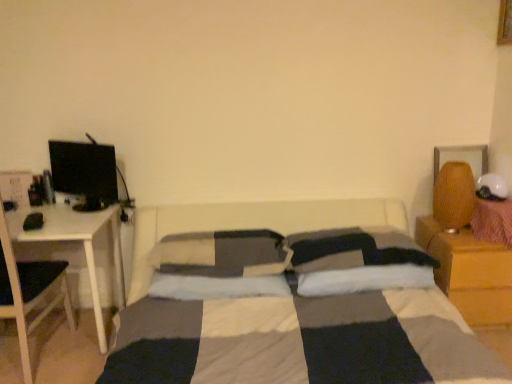
What do you see at coordinates (216, 287) in the screenshot?
I see `soft gray pillow at center, which ranks as the second pillow in left-to-right order` at bounding box center [216, 287].

Locate an element on the screen. white soft pillow at center, the 3th pillow in the left-to-right sequence is located at coordinates (357, 261).

Measure the distance between point (304, 264) and camera.

Point (304, 264) is 2.13 meters from camera.

From the picture: Measure the distance between white soft pillow at center, the 3th pillow when ordered from right to left, and camera.

white soft pillow at center, the 3th pillow when ordered from right to left, and camera are 2.14 meters apart from each other.

The height and width of the screenshot is (384, 512). What do you see at coordinates (222, 254) in the screenshot? I see `white soft pillow at center, which is the 1th pillow in left-to-right order` at bounding box center [222, 254].

Locate an element on the screen. Image resolution: width=512 pixels, height=384 pixels. textured brown lampshade at right is located at coordinates (454, 196).

You are a GUI agent. You are given a task and a screenshot of the screen. Output one action in this format:
    pyautogui.click(x=<x>, y=<y>)
    Task: Click on the 3rd pillow below when counting from the textured brown lampshade at right (from the image's perspective)
    The image size is (512, 384).
    Given the screenshot: What is the action you would take?
    pyautogui.click(x=216, y=287)

Is there a large distance between soft gray pillow at center, marked as the second pillow in a right-to-left arrangement, and textured brown lampshade at right?

Absolutely, soft gray pillow at center, marked as the second pillow in a right-to-left arrangement, is distant from textured brown lampshade at right.

Between soft gray pillow at center, which ranks as the second pillow in left-to-right order, and textured brown lampshade at right, which one is positioned behind?

textured brown lampshade at right.

Does white soft pillow at center, the 3th pillow when ordered from right to left, have a lesser width compared to soft gray pillow at center, which ranks as the second pillow in left-to-right order?

No, white soft pillow at center, the 3th pillow when ordered from right to left, is not thinner than soft gray pillow at center, which ranks as the second pillow in left-to-right order.

Would you say white soft pillow at center, which is the 1th pillow in left-to-right order, contains soft gray pillow at center, which ranks as the second pillow in left-to-right order?

That's incorrect, soft gray pillow at center, which ranks as the second pillow in left-to-right order, is not inside white soft pillow at center, which is the 1th pillow in left-to-right order.

Is point (251, 253) positioned in front of point (234, 278)?

No, (251, 253) is further to viewer.

From the image's perspective, does soft gray pillow at center, which ranks as the second pillow in left-to-right order, appear lower than black glossy computer monitor at left?

Indeed, from the image's perspective, soft gray pillow at center, which ranks as the second pillow in left-to-right order, is shown beneath black glossy computer monitor at left.

Is soft gray pillow at center, which ranks as the second pillow in left-to-right order, turned away from black glossy computer monitor at left?

No.

What's the angular difference between soft gray pillow at center, marked as the second pillow in a right-to-left arrangement, and black glossy computer monitor at left's facing directions?

There is a 28.7-degree angle between the facing directions of soft gray pillow at center, marked as the second pillow in a right-to-left arrangement, and black glossy computer monitor at left.

Who is more distant, soft gray pillow at center, which ranks as the second pillow in left-to-right order, or black glossy computer monitor at left?

black glossy computer monitor at left.

From the image's perspective, is soft gray pillow at center, which ranks as the second pillow in left-to-right order, over white soft pillow at center, the first pillow when ordered from right to left?

No, from the image's perspective, soft gray pillow at center, which ranks as the second pillow in left-to-right order, is not over white soft pillow at center, the first pillow when ordered from right to left.

Locate an element on the screen. The height and width of the screenshot is (384, 512). pillow below the white soft pillow at center, the first pillow when ordered from right to left (from the image's perspective) is located at coordinates (216, 287).

Does soft gray pillow at center, marked as the second pillow in a right-to-left arrangement, have a lesser height compared to white soft pillow at center, the first pillow when ordered from right to left?

No.

Does soft gray pillow at center, which ranks as the second pillow in left-to-right order, have a smaller size compared to white soft pillow at center, the 3th pillow in the left-to-right sequence?

Incorrect, soft gray pillow at center, which ranks as the second pillow in left-to-right order, is not smaller in size than white soft pillow at center, the 3th pillow in the left-to-right sequence.

Is there a large distance between white soft pillow at center, the first pillow when ordered from right to left, and wooden nightstand at right?

No, white soft pillow at center, the first pillow when ordered from right to left, is in close proximity to wooden nightstand at right.

How much distance is there between white soft pillow at center, the first pillow when ordered from right to left, and wooden nightstand at right?

They are 15.18 inches apart.

Is white soft pillow at center, the 3th pillow in the left-to-right sequence, oriented away from wooden nightstand at right?

No, white soft pillow at center, the 3th pillow in the left-to-right sequence,'s orientation is not away from wooden nightstand at right.

Do you think white soft pillow at center, the 3th pillow in the left-to-right sequence, is within wooden nightstand at right, or outside of it?

white soft pillow at center, the 3th pillow in the left-to-right sequence, is not enclosed by wooden nightstand at right.

Which of these two, wooden nightstand at right or white soft pillow at center, which is the 1th pillow in left-to-right order, stands shorter?

white soft pillow at center, which is the 1th pillow in left-to-right order, is shorter.

Is wooden nightstand at right not close to white soft pillow at center, the 3th pillow when ordered from right to left?

Yes.

Is wooden nightstand at right not within white soft pillow at center, which is the 1th pillow in left-to-right order?

Indeed, wooden nightstand at right is completely outside white soft pillow at center, which is the 1th pillow in left-to-right order.

Would you say soft gray pillow at center, marked as the second pillow in a right-to-left arrangement, is part of wooden nightstand at right's contents?

No, wooden nightstand at right does not contain soft gray pillow at center, marked as the second pillow in a right-to-left arrangement.

From the picture: Can you confirm if wooden nightstand at right is positioned to the left of soft gray pillow at center, which ranks as the second pillow in left-to-right order?

No.

Is point (448, 255) less distant than point (213, 292)?

No, it is behind (213, 292).

From a real-world perspective, who is located lower, wooden nightstand at right or soft gray pillow at center, which ranks as the second pillow in left-to-right order?

From a 3D spatial view, wooden nightstand at right is below.

Find the location of a particular element. the 3rd pillow below the textured brown lampshade at right (from the image's perspective) is located at coordinates (x=216, y=287).

Where is `the 1st pillow to the right of the white soft pillow at center, which is the 1th pillow in left-to-right order, starting your count from the anchor`? The height and width of the screenshot is (384, 512). the 1st pillow to the right of the white soft pillow at center, which is the 1th pillow in left-to-right order, starting your count from the anchor is located at coordinates click(216, 287).

From the image, which object appears to be nearer to soft gray pillow at center, which ranks as the second pillow in left-to-right order, black glossy computer monitor at left or white soft pillow at center, which is the 1th pillow in left-to-right order?

Among the two, white soft pillow at center, which is the 1th pillow in left-to-right order, is located nearer to soft gray pillow at center, which ranks as the second pillow in left-to-right order.

From the image, which object appears to be nearer to wooden nightstand at right, white soft pillow at center, which is the 1th pillow in left-to-right order, or black glossy computer monitor at left?

white soft pillow at center, which is the 1th pillow in left-to-right order.

Looking at the image, which one is located closer to wooden nightstand at right, white soft pillow at center, the 3th pillow in the left-to-right sequence, or soft gray pillow at center, marked as the second pillow in a right-to-left arrangement?

white soft pillow at center, the 3th pillow in the left-to-right sequence, is closer to wooden nightstand at right.

Looking at this image, which object lies nearer to the anchor point white soft pillow at center, the 3th pillow when ordered from right to left, black glossy computer monitor at left or white soft pillow at center, the 3th pillow in the left-to-right sequence?

Among the two, white soft pillow at center, the 3th pillow in the left-to-right sequence, is located nearer to white soft pillow at center, the 3th pillow when ordered from right to left.

When comparing their distances from soft gray pillow at center, marked as the second pillow in a right-to-left arrangement, does textured brown lampshade at right or black glossy computer monitor at left seem closer?

black glossy computer monitor at left is closer to soft gray pillow at center, marked as the second pillow in a right-to-left arrangement.

When comparing their distances from soft gray pillow at center, which ranks as the second pillow in left-to-right order, does white soft pillow at center, the 3th pillow in the left-to-right sequence, or white glossy table at left seem further?

white glossy table at left lies further to soft gray pillow at center, which ranks as the second pillow in left-to-right order, than the other object.

Which object lies further to the anchor point textured brown lampshade at right, white soft pillow at center, which is the 1th pillow in left-to-right order, or black glossy computer monitor at left?

black glossy computer monitor at left is further to textured brown lampshade at right.

Looking at the image, which one is located closer to wooden nightstand at right, soft gray pillow at center, which ranks as the second pillow in left-to-right order, or white glossy table at left?

Among the two, soft gray pillow at center, which ranks as the second pillow in left-to-right order, is located nearer to wooden nightstand at right.

Find the location of a particular element. This screenshot has width=512, height=384. table lamp between white glossy table at left and wooden nightstand at right is located at coordinates (454, 196).

Locate an element on the screen. The height and width of the screenshot is (384, 512). table lamp between soft gray pillow at center, marked as the second pillow in a right-to-left arrangement, and wooden nightstand at right is located at coordinates (454, 196).

This screenshot has width=512, height=384. In order to click on computer monitor between white glossy table at left and white soft pillow at center, the 3th pillow when ordered from right to left, from left to right in this screenshot , I will do `click(84, 170)`.

Locate an element on the screen. This screenshot has height=384, width=512. computer monitor between white glossy table at left and textured brown lampshade at right from left to right is located at coordinates (84, 170).